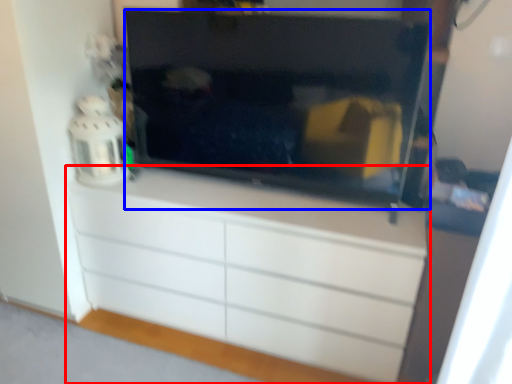
Question: Which point is further to the camera, chest of drawers (highlighted by a red box) or television (highlighted by a blue box)?

Choices:
 (A) chest of drawers
 (B) television

Answer: (A)